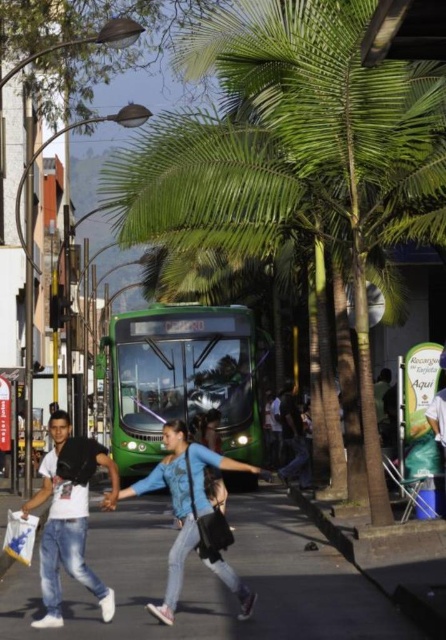
Who is more distant from viewer, (164, 401) or (9, 528)?

Positioned behind is point (164, 401).

Does green matte bus at center have a greater width compared to white plastic bag at lower left?

Correct, the width of green matte bus at center exceeds that of white plastic bag at lower left.

Does point (151, 404) come closer to viewer compared to point (37, 524)?

No, it is not.

Where is `green matte bus at center`? The height and width of the screenshot is (640, 446). green matte bus at center is located at coordinates (181, 380).

Is dark blue jeans at center thinner than white plastic bag at lower left?

No, dark blue jeans at center is not thinner than white plastic bag at lower left.

Describe the element at coordinates (293, 438) in the screenshot. The image size is (446, 640). I see `dark blue jeans at center` at that location.

The height and width of the screenshot is (640, 446). I want to click on dark blue jeans at center, so click(293, 438).

Who is lower down, white matte t-shirt at left or dark blue jeans at center?

dark blue jeans at center is below.

In the scene shown: Who is higher up, white matte t-shirt at left or dark blue jeans at center?

white matte t-shirt at left

The image size is (446, 640). Describe the element at coordinates (70, 516) in the screenshot. I see `white matte t-shirt at left` at that location.

Image resolution: width=446 pixels, height=640 pixels. I want to click on white matte t-shirt at left, so click(x=70, y=516).